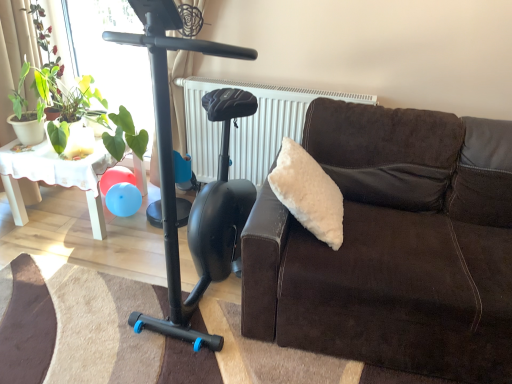
Where is `vacant region under white lace table at left (from a real-world perspective)`? The width and height of the screenshot is (512, 384). vacant region under white lace table at left (from a real-world perspective) is located at coordinates 68,213.